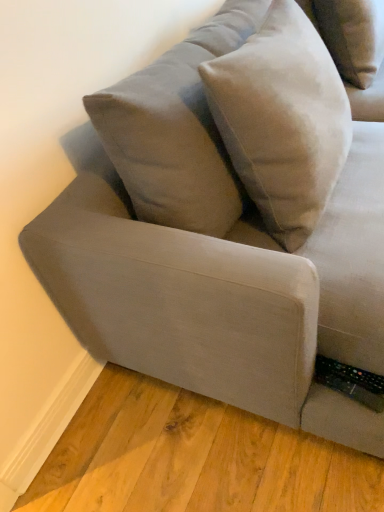
Identify the location of suede beige pillow at upper center. Image resolution: width=384 pixels, height=512 pixels. (282, 120).

The height and width of the screenshot is (512, 384). What do you see at coordinates (282, 120) in the screenshot?
I see `suede beige pillow at upper center` at bounding box center [282, 120].

Describe the element at coordinates (353, 36) in the screenshot. I see `suede-like beige pillow at upper right` at that location.

Identify the location of suede-like beige pillow at upper right. Image resolution: width=384 pixels, height=512 pixels. (353, 36).

What is the approximate width of suede-like beige pillow at upper right?

It is 15.11 inches.

Find the location of `suede beige pillow at upper center`. suede beige pillow at upper center is located at coordinates (282, 120).

Considering the positions of objects suede-like beige pillow at upper right and suede beige pillow at upper center in the image provided, who is more to the left, suede-like beige pillow at upper right or suede beige pillow at upper center?

suede beige pillow at upper center.

From the picture: Which object is further away from the camera, suede-like beige pillow at upper right or suede beige pillow at upper center?

suede-like beige pillow at upper right is further away from the camera.

Is point (326, 25) positioned before point (275, 40)?

No, it is not.

From the image's perspective, is suede-like beige pillow at upper right on suede beige pillow at upper center?

Correct, suede-like beige pillow at upper right appears higher than suede beige pillow at upper center in the image.

From a real-world perspective, which is physically above, suede-like beige pillow at upper right or suede beige pillow at upper center?

suede beige pillow at upper center, from a real-world perspective.

Considering the sizes of objects suede-like beige pillow at upper right and suede beige pillow at upper center in the image provided, who is wider, suede-like beige pillow at upper right or suede beige pillow at upper center?

suede-like beige pillow at upper right is wider.

Looking at this image, can you confirm if suede-like beige pillow at upper right is shorter than suede beige pillow at upper center?

Yes.

Considering the relative sizes of suede-like beige pillow at upper right and suede beige pillow at upper center in the image provided, is suede-like beige pillow at upper right bigger than suede beige pillow at upper center?

No, suede-like beige pillow at upper right is not bigger than suede beige pillow at upper center.

Would you say suede-like beige pillow at upper right is inside or outside suede beige pillow at upper center?

suede-like beige pillow at upper right exists outside the volume of suede beige pillow at upper center.

Is suede-like beige pillow at upper right not close to suede beige pillow at upper center?

No, suede-like beige pillow at upper right is not far away from suede beige pillow at upper center.

Could you tell me if suede-like beige pillow at upper right is facing suede beige pillow at upper center?

No, suede-like beige pillow at upper right is not aimed at suede beige pillow at upper center.

Where is `pillow below the suede beige pillow at upper center (from a real-world perspective)`? The image size is (384, 512). pillow below the suede beige pillow at upper center (from a real-world perspective) is located at coordinates (353, 36).

Consider the image. Visually, is suede beige pillow at upper center positioned to the left or to the right of suede-like beige pillow at upper right?

Based on their positions, suede beige pillow at upper center is located to the left of suede-like beige pillow at upper right.

Relative to suede-like beige pillow at upper right, is suede beige pillow at upper center in front or behind?

suede beige pillow at upper center is in front of suede-like beige pillow at upper right.

Does point (302, 112) lie behind point (344, 72)?

No, it is not.

From the image's perspective, is suede beige pillow at upper center located above suede-like beige pillow at upper right?

No, from the image's perspective, suede beige pillow at upper center is not on top of suede-like beige pillow at upper right.

From a real-world perspective, is suede beige pillow at upper center positioned above or below suede-like beige pillow at upper right?

In terms of real-world spatial position, suede beige pillow at upper center is above suede-like beige pillow at upper right.

Considering the sizes of objects suede beige pillow at upper center and suede-like beige pillow at upper right in the image provided, who is thinner, suede beige pillow at upper center or suede-like beige pillow at upper right?

With smaller width is suede beige pillow at upper center.

Can you confirm if suede beige pillow at upper center is shorter than suede-like beige pillow at upper right?

No, suede beige pillow at upper center is not shorter than suede-like beige pillow at upper right.

Looking at this image, which of these two, suede beige pillow at upper center or suede-like beige pillow at upper right, is smaller?

Smaller between the two is suede-like beige pillow at upper right.

Can suede-like beige pillow at upper right be found inside suede beige pillow at upper center?

No, suede-like beige pillow at upper right is located outside of suede beige pillow at upper center.

Is the surface of suede beige pillow at upper center in direct contact with suede-like beige pillow at upper right?

No, suede beige pillow at upper center is not touching suede-like beige pillow at upper right.

Is suede-like beige pillow at upper right at the back of suede beige pillow at upper center?

No.

How different are the orientations of suede beige pillow at upper center and suede-like beige pillow at upper right in degrees?

suede beige pillow at upper center and suede-like beige pillow at upper right are facing 0.000935 degrees away from each other.

Measure the distance between suede beige pillow at upper center and suede-like beige pillow at upper right.

suede beige pillow at upper center and suede-like beige pillow at upper right are 26.84 inches apart from each other.

Locate an element on the screen. This screenshot has width=384, height=512. pillow beneath the suede beige pillow at upper center (from a real-world perspective) is located at coordinates (353, 36).

I want to click on throw pillow in front of the suede-like beige pillow at upper right, so click(x=282, y=120).

Where is `pillow below the suede beige pillow at upper center (from a real-world perspective)`? Image resolution: width=384 pixels, height=512 pixels. pillow below the suede beige pillow at upper center (from a real-world perspective) is located at coordinates (353, 36).